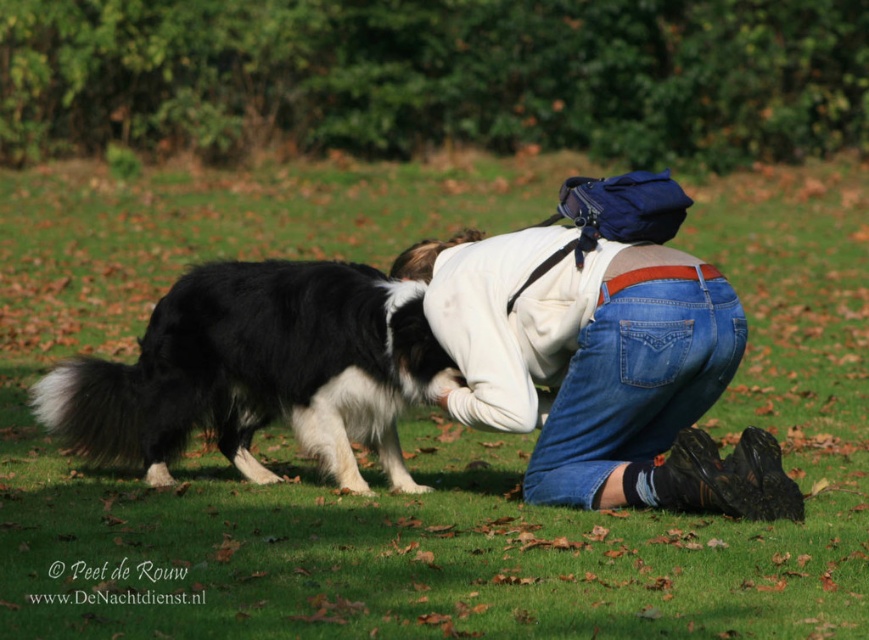
You are a photographer trying to capture the perfect shot of the scene. You need to focus on the denim jeans at center. What are the coordinates where you should aim your camera?

The denim jeans at center are located at point (x=601, y=374), so you should aim your camera there.

You are a drone operator trying to capture a photo of the person and their dog in the park. The drone is currently at the point marked by coordinates point (x=601, y=374). Where should you position the drone to ensure both the denim jeans at center and the dog are clearly visible in the shot?

The point (x=601, y=374) corresponds to the denim jeans at center. To capture both the denim jeans at center and the dog, the drone should be positioned above the denim jeans at center to ensure both subjects are in frame.